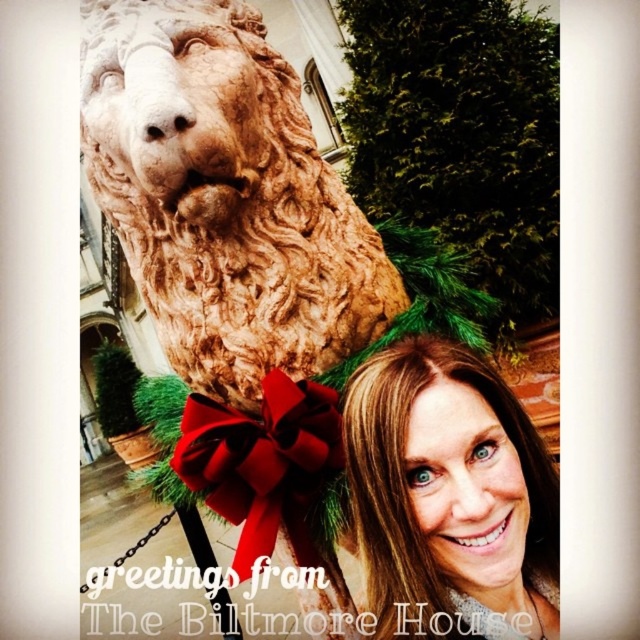
You are a photographer standing in front of the brown stone lion at upper left and the blonde hair at center. You want to capture a photo that includes both subjects. Which subject should you focus on first to ensure both are in frame?

The brown stone lion at upper left is larger in size than the blonde hair at center, so you should focus on the brown stone lion at upper left first to ensure both are in frame.

In the scene shown: You are standing at the center of the image. Which direction should you move to get closer to the brown stone lion at upper left?

You should move to the left and upwards to get closer to the brown stone lion at upper left since it is located at point (225,196).